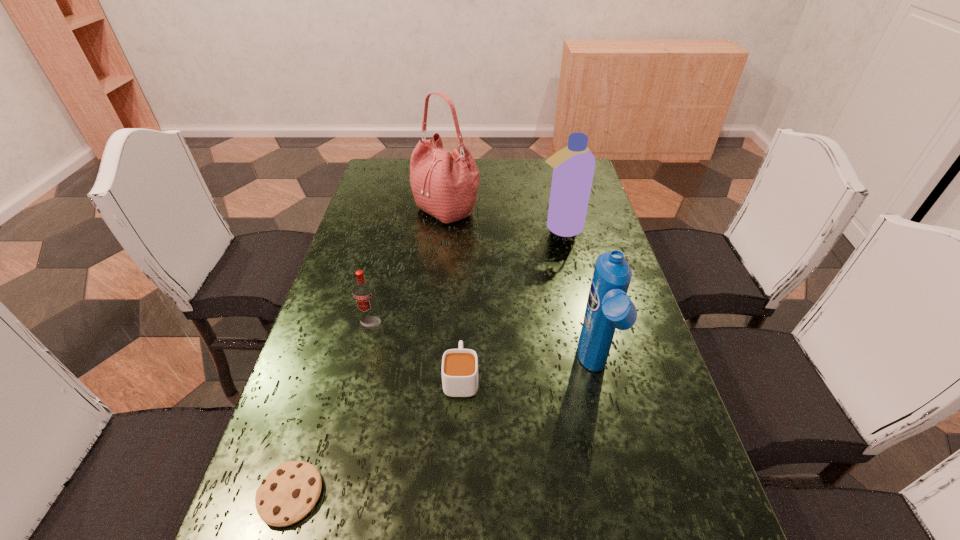
Where is `free spot between the cup and the shortest object`? The width and height of the screenshot is (960, 540). free spot between the cup and the shortest object is located at coordinates (375, 436).

At what (x,y) coordinates should I click in order to perform the action: click on blank region between the vodka and the cookie. Please return your answer as a coordinate pair (x, y). The height and width of the screenshot is (540, 960). Looking at the image, I should click on (331, 409).

Point out which object is positioned as the fifth nearest to the fifth tallest object. Please provide its 2D coordinates. Your answer should be formatted as a tuple, i.e. [(x, y)], where the tuple contains the x and y coordinates of a point satisfying the conditions above.

[(444, 184)]

Locate an element on the screen. The height and width of the screenshot is (540, 960). object that stands as the fifth closest to the nearer shampoo is located at coordinates (289, 492).

Where is `free location that satisfies the following two spatial constraints: 1. on the side with the handle of the second shortest object; 2. on the left side of the nearer shampoo`? free location that satisfies the following two spatial constraints: 1. on the side with the handle of the second shortest object; 2. on the left side of the nearer shampoo is located at coordinates (462, 369).

Image resolution: width=960 pixels, height=540 pixels. I want to click on free location that satisfies the following two spatial constraints: 1. on the side with the handle of the farther shampoo; 2. on the right side of the cup, so click(x=467, y=228).

Locate an element on the screen. free region that satisfies the following two spatial constraints: 1. on the side with the handle of the nearer shampoo; 2. on the right side of the cup is located at coordinates (462, 369).

Where is `free space that satisfies the following two spatial constraints: 1. on the front label of the fourth nearest object; 2. on the right side of the nearer shampoo`? free space that satisfies the following two spatial constraints: 1. on the front label of the fourth nearest object; 2. on the right side of the nearer shampoo is located at coordinates (360, 369).

Identify the location of vacant space that satisfies the following two spatial constraints: 1. on the side with the handle of the nearer shampoo; 2. on the right side of the second shortest object. (462, 369).